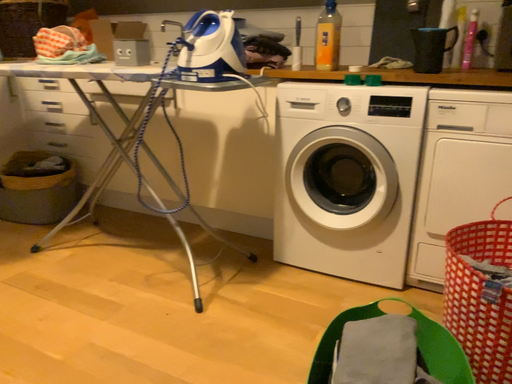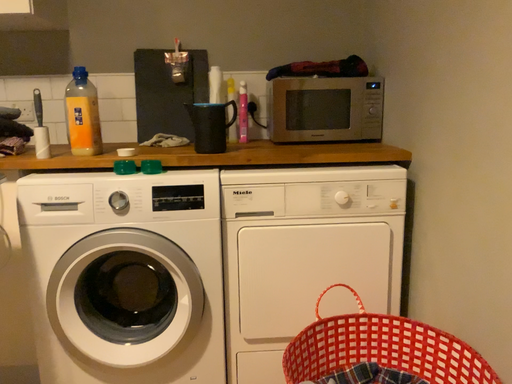
Question: How did the camera likely rotate when shooting the video?

Choices:
 (A) rotated left
 (B) rotated right

Answer: (B)